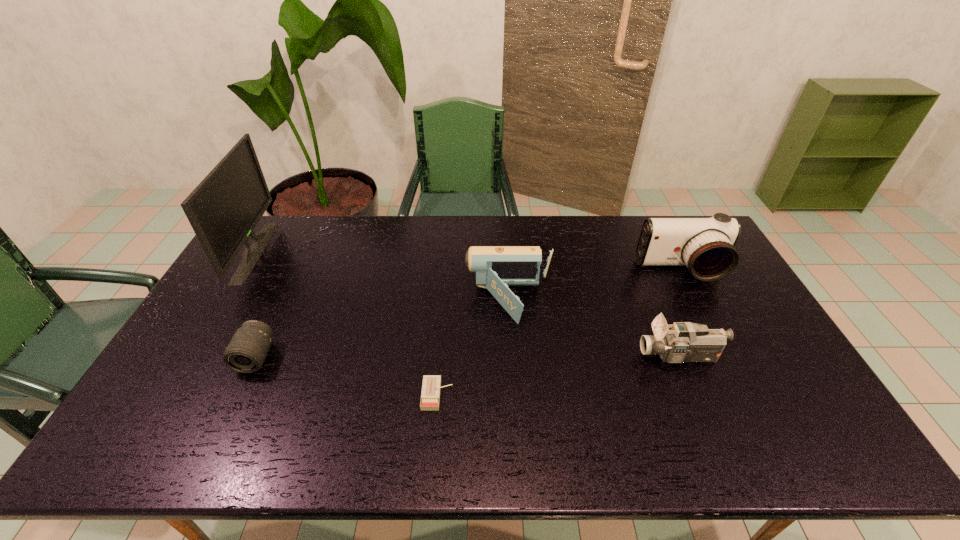
The image size is (960, 540). I want to click on free space located on the surface of the tallest camcorder, so click(709, 325).

What are the coordinates of `free spot located 0.300m on the side of the leftmost camcorder with the flip-out screen` in the screenshot? It's located at (370, 301).

Locate an element on the screen. This screenshot has width=960, height=540. vacant point located on the side of the leftmost camcorder with the flip-out screen is located at coordinates (420, 301).

This screenshot has height=540, width=960. I want to click on vacant space positioned 0.110m on the side of the leftmost camcorder with the flip-out screen, so [x=430, y=301].

You are a GUI agent. You are given a task and a screenshot of the screen. Output one action in this format:
    pyautogui.click(x=<x>, y=<y>)
    Task: Click on the free space located on the front-facing side of the nearest camcorder
    
    Given the screenshot: What is the action you would take?
    pyautogui.click(x=597, y=356)

The image size is (960, 540). I want to click on vacant position located on the front-facing side of the nearest camcorder, so click(x=517, y=356).

The image size is (960, 540). In order to click on free space located on the front-facing side of the nearest camcorder in this screenshot , I will do `click(589, 356)`.

At what (x,y) coordinates should I click in order to perform the action: click on vacant space situated on the surface of the fifth tallest object. Please return your answer as a coordinate pair (x, y). The height and width of the screenshot is (540, 960). Looking at the image, I should click on (233, 405).

The image size is (960, 540). I want to click on vacant region located 0.120m on the striking surface of the shortest object, so click(499, 395).

The image size is (960, 540). In order to click on object at the far edge in this screenshot , I will do `click(223, 210)`.